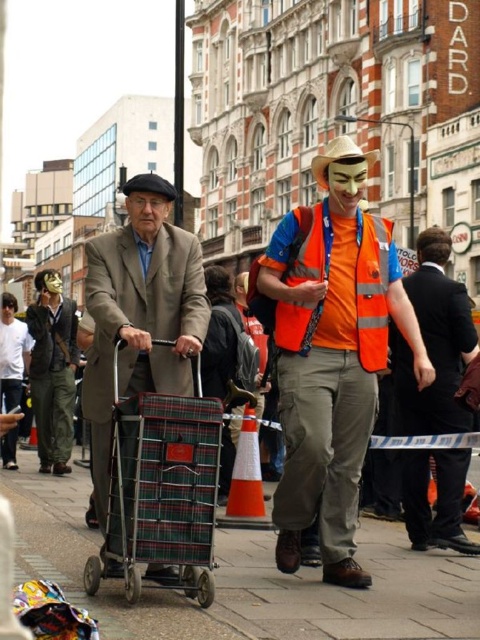
Question: From the image, what is the correct spatial relationship of plaid fabric shopping cart at center in relation to smooth beige face at center?

Choices:
 (A) left
 (B) right

Answer: (B)

Question: Which of these objects is positioned closest to the plaid fabric trolley at center?

Choices:
 (A) matte black mask at lower left
 (B) orange reflective vest at center

Answer: (B)

Question: Among these objects, which one is nearest to the camera?

Choices:
 (A) matte orange mask at center
 (B) matte black mask at center
 (C) smooth beige face at center
 (D) reflective orange vest at center

Answer: (D)

Question: Is matte orange mask at center positioned behind smooth beige face at center?

Choices:
 (A) yes
 (B) no

Answer: (B)

Question: Estimate the real-world distances between objects in this image. Which object is farther from the matte black mask at center?

Choices:
 (A) matte black mask at lower left
 (B) plaid fabric trolley at center
 (C) smooth beige face at center
 (D) reflective orange vest at center

Answer: (D)

Question: Can you confirm if reflective orange vest at center is positioned to the right of plaid fabric trolley at center?

Choices:
 (A) yes
 (B) no

Answer: (A)